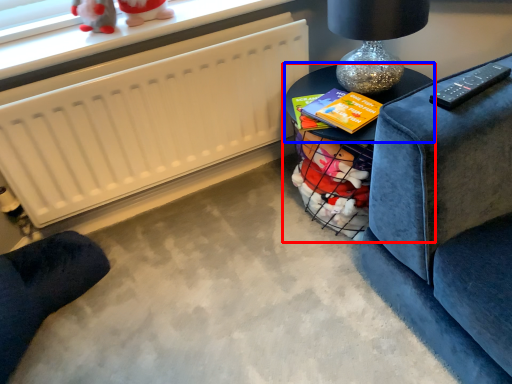
Question: Which point is closer to the camera, table (highlighted by a red box) or table (highlighted by a blue box)?

Choices:
 (A) table
 (B) table

Answer: (A)